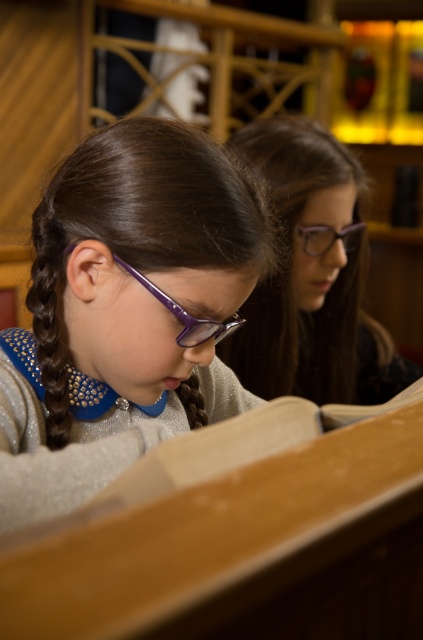
You are a photographer trying to capture a closeup of the book the two girls are reading. The camera you are using has a focal length of 50mm and an aperture of f2.8. You need to ensure that the book is in focus and fills the frame. Given that the point representing the book is located at coordinates point (170, 301) and is 70.34 centimeters from the camera, can you determine if the book will be in focus and properly framed?

The point (170, 301) is 70.34 centimeters from the camera. With a 50mm lens and f2.8 aperture, the depth of field should allow the book to be in focus at that distance. However, to ensure the book fills the frame, you may need to adjust your position slightly closer or use a zoom lens for better framing.

Consider the image. You are a photographer taking a picture of the two girls reading a book. You notice the purple acetate glasses at center and the brown braided hair at center. Which object should you focus on to ensure it appears larger in the photo?

The purple acetate glasses at center is bigger than brown braided hair at center, so focusing on the purple acetate glasses at center will ensure it appears larger in the photo.

You are standing in front of the two girls reading a book. You want to take a photo of their glasses without disturbing them. The camera you have is 3.76 feet away from the matte purple glasses at upper center. Can you capture both pairs of glasses in the photo?

The matte purple glasses at upper center and camera are 3.76 feet apart from each other, so yes, the camera can capture the matte purple glasses at upper center in the photo since it is positioned at that distance.